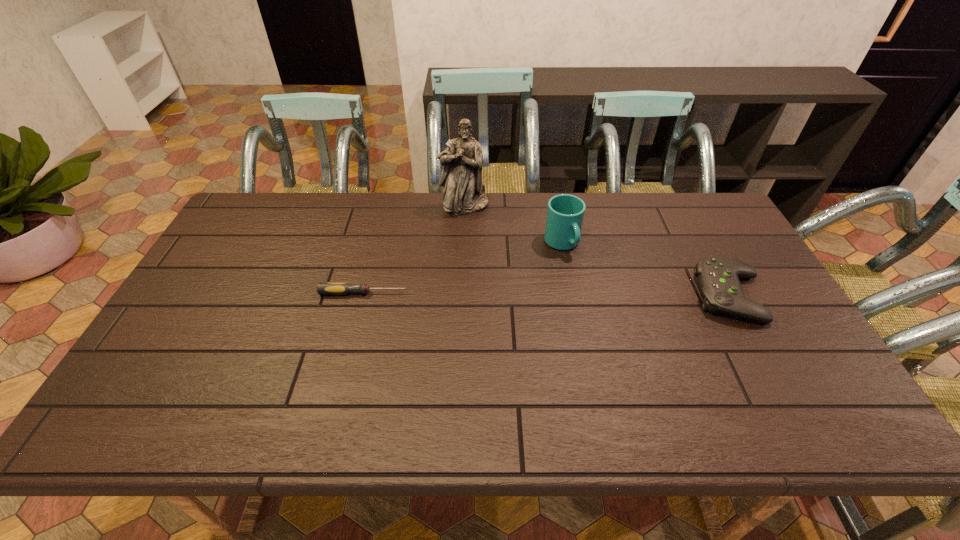
In the image, there is a desktop. Identify the location of vacant space at the near edge. (468, 383).

Identify the location of blank space at the left edge of the desktop. (217, 305).

The width and height of the screenshot is (960, 540). Identify the location of vacant space at the right edge. (774, 294).

The width and height of the screenshot is (960, 540). I want to click on vacant space at the far left corner of the desktop, so click(x=275, y=194).

At what (x,y) coordinates should I click in order to perform the action: click on blank space at the far right corner of the desktop. Please return your answer as a coordinate pair (x, y). Looking at the image, I should click on (687, 215).

Locate an element on the screen. This screenshot has width=960, height=540. free space at the near right corner of the desktop is located at coordinates (832, 384).

The image size is (960, 540). I want to click on unoccupied position between the second shortest object and the screwdriver, so click(547, 294).

You are a GUI agent. You are given a task and a screenshot of the screen. Output one action in this format:
    pyautogui.click(x=<x>, y=<y>)
    Task: Click on the unoccupied area between the third nearest object and the figurine
    Image resolution: width=960 pixels, height=540 pixels.
    Given the screenshot: What is the action you would take?
    pyautogui.click(x=514, y=225)

Find the location of a particular element. free space that is in between the tallest object and the second farthest object is located at coordinates (514, 225).

Identify the location of vacant region between the shortest object and the second farthest object. The image size is (960, 540). (463, 268).